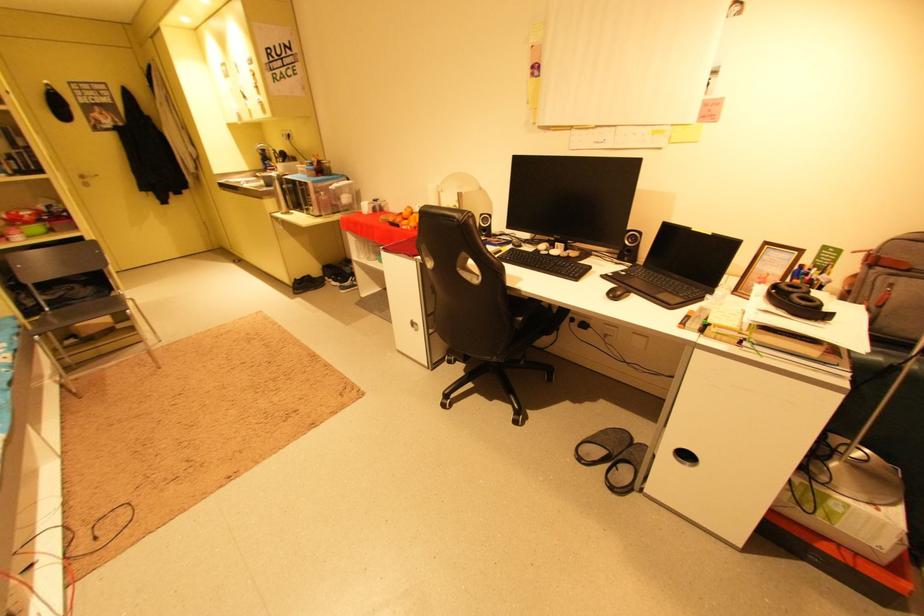
Find where to pull the round cabinet handle. Please return your answer as a coordinate pair (x, y).

(412, 325)